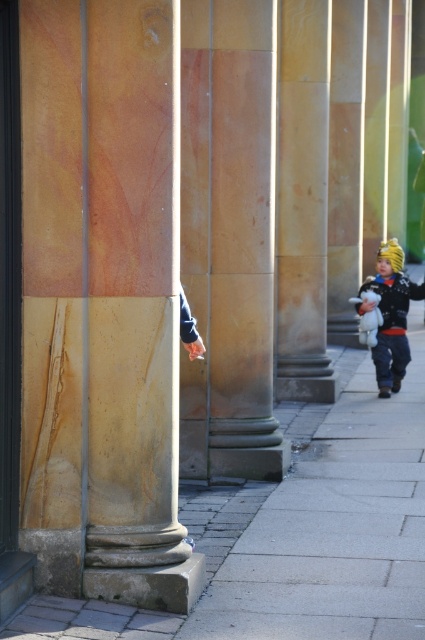
Which is behind, point (340, 352) or point (405, 336)?

Point (340, 352)

Identify the location of gray concrete pavement at center. The width and height of the screenshot is (425, 640). (297, 532).

Is marble column at center positioned before gray concrete pavement at center?

That is False.

Is point (62, 150) positioned behind point (300, 625)?

No, (62, 150) is in front of (300, 625).

Find the location of `marble column at center`. marble column at center is located at coordinates (102, 301).

Who is positioned more to the right, marble column at center or matte black jacket at lower right?

matte black jacket at lower right is more to the right.

From the picture: Does marble column at center have a smaller size compared to matte black jacket at lower right?

No, marble column at center is not smaller than matte black jacket at lower right.

You are a GUI agent. You are given a task and a screenshot of the screen. Output one action in this format:
    pyautogui.click(x=<x>, y=<y>)
    Task: Click on the marble column at center
    
    Given the screenshot: What is the action you would take?
    pyautogui.click(x=102, y=301)